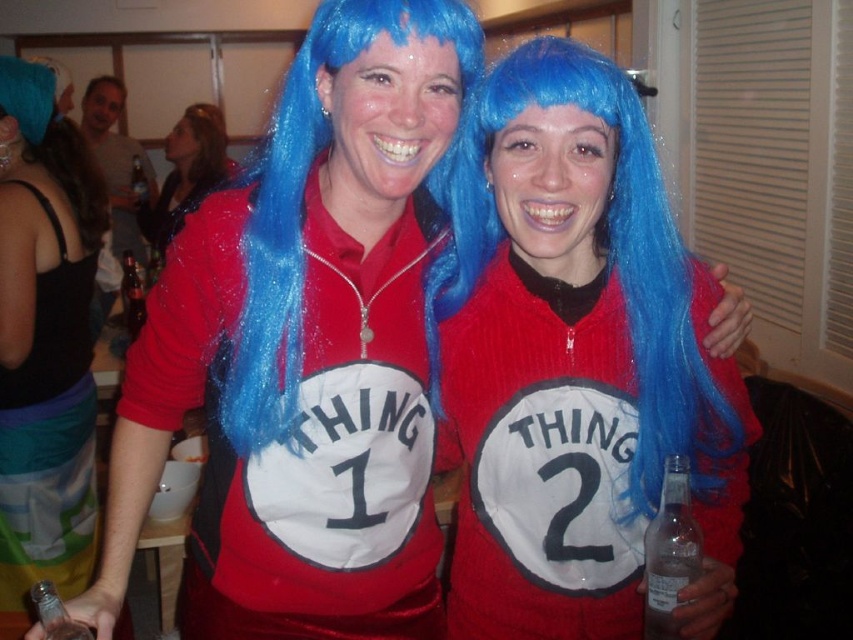
Question: Does fuzzy red sweater at center come in front of black satin dress at left?

Choices:
 (A) no
 (B) yes

Answer: (B)

Question: Is matte plastic beer bottle at upper left thinner than brown matte hair at upper left?

Choices:
 (A) no
 (B) yes

Answer: (A)

Question: Which point is closer to the camera?

Choices:
 (A) (84, 140)
 (B) (131, 310)
 (C) (114, 83)
 (D) (122, 196)

Answer: (A)

Question: Considering the real-world distances, which object is closest to the clear glass bottle at lower left?

Choices:
 (A) clear glass bottle at lower right
 (B) blue synthetic wig at upper left

Answer: (A)

Question: Which object is positioned farthest from the matte plastic beer bottle at upper left?

Choices:
 (A) red glittery wig at center
 (B) clear glass bottle at lower left

Answer: (B)

Question: Can you confirm if red glittery wig at center is bigger than blue synthetic wig at upper center?

Choices:
 (A) no
 (B) yes

Answer: (B)